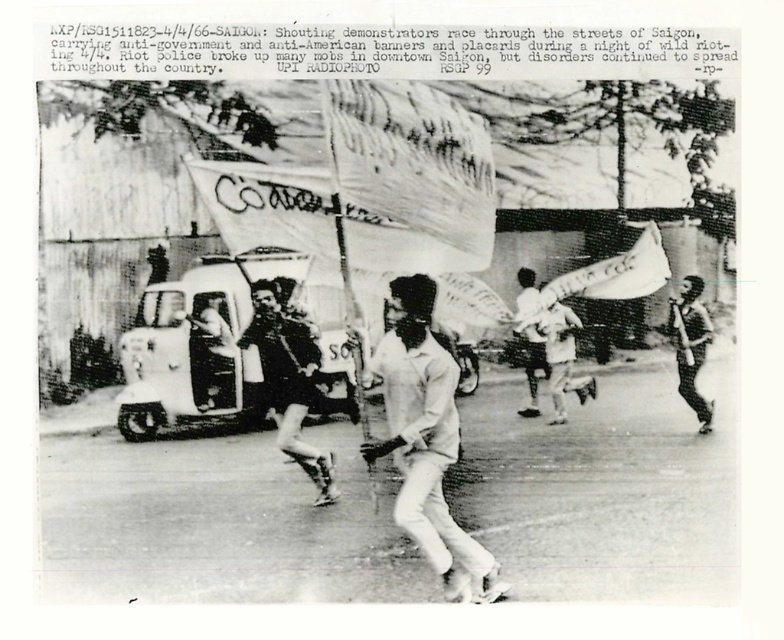
You are a photographer analyzing this historical image. You notice the white matte shirt at center and the dark brown leather boots at center. Which object appears larger in the photo?

The white matte shirt at center appears much larger than the dark brown leather boots at center in the photo.

You are a photographer analyzing this historical protest image. You notice the white matte shirt at center and the dark brown leather boots at center. Based on their positions, which object is closer to the camera?

The white matte shirt at center is positioned under the dark brown leather boots at center, meaning the boots are closer to the camera since they are above the shirt in the frame.

In the protest scene from Saigon, you notice a white matte shirt at center and a dark skin human at right. Which of these two has a larger size in the image?

The white matte shirt at center is bigger than the dark skin human at right in the image.